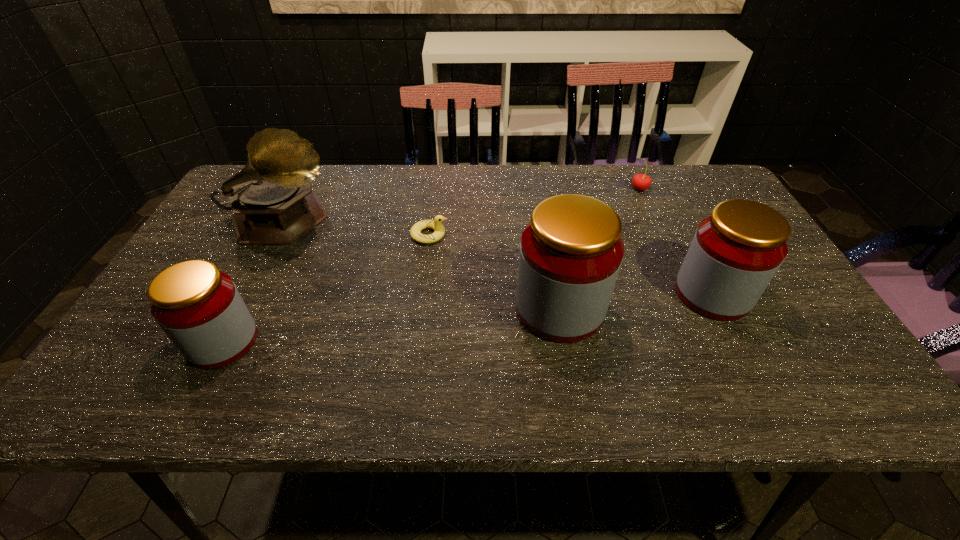
Image resolution: width=960 pixels, height=540 pixels. Identify the location of blank area in the image that satisfies the following two spatial constraints: 1. on the back side of the fourth object from left to right; 2. on the face of the fourth object from right to left. (547, 235).

Where is `vacant space that satisfies the following two spatial constraints: 1. on the face of the second jar from right to left; 2. on the left side of the duckling`? vacant space that satisfies the following two spatial constraints: 1. on the face of the second jar from right to left; 2. on the left side of the duckling is located at coordinates (420, 309).

The height and width of the screenshot is (540, 960). I want to click on vacant space that satisfies the following two spatial constraints: 1. on the face of the fourth object from left to right; 2. on the left side of the shortest object, so click(420, 309).

Identify the location of vacant area in the image that satisfies the following two spatial constraints: 1. on the horn direction of the phonograph record; 2. on the back side of the fourth shortest object. The image size is (960, 540). (247, 294).

Locate an element on the screen. vacant area that satisfies the following two spatial constraints: 1. on the horn direction of the rightmost jar; 2. on the left side of the phonograph record is located at coordinates (247, 294).

You are a GUI agent. You are given a task and a screenshot of the screen. Output one action in this format:
    pyautogui.click(x=<x>, y=<y>)
    Task: Click on the vacant space that satisfies the following two spatial constraints: 1. on the horn direction of the second tallest jar; 2. on the right side of the phonograph record
    
    Given the screenshot: What is the action you would take?
    pyautogui.click(x=247, y=294)